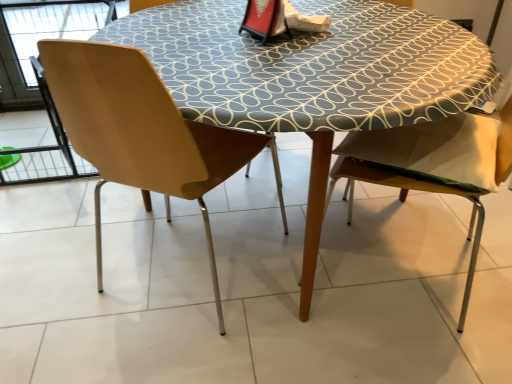
Question: Considering the relative sizes of wooden chair at right, the 2th chair when ordered from left to right, and wooden table at center in the image provided, is wooden chair at right, the 2th chair when ordered from left to right, bigger than wooden table at center?

Choices:
 (A) no
 (B) yes

Answer: (A)

Question: Does wooden chair at right, the 2th chair when ordered from left to right, come behind wooden table at center?

Choices:
 (A) no
 (B) yes

Answer: (A)

Question: Considering the relative sizes of wooden chair at right, the 2th chair when ordered from left to right, and wooden table at center in the image provided, is wooden chair at right, the 2th chair when ordered from left to right, shorter than wooden table at center?

Choices:
 (A) no
 (B) yes

Answer: (A)

Question: Would you consider wooden chair at right, which is the 1th chair from right to left, to be distant from wooden table at center?

Choices:
 (A) yes
 (B) no

Answer: (B)

Question: Is wooden chair at right, the 2th chair when ordered from left to right, at the right side of wooden table at center?

Choices:
 (A) no
 (B) yes

Answer: (B)

Question: Can you confirm if wooden chair at right, the 2th chair when ordered from left to right, is wider than wooden table at center?

Choices:
 (A) yes
 (B) no

Answer: (B)

Question: Is matte wood chair at left, arranged as the 1th chair when viewed from the left, placed right next to wooden table at center?

Choices:
 (A) yes
 (B) no

Answer: (B)

Question: Considering the relative sizes of matte wood chair at left, arranged as the 1th chair when viewed from the left, and wooden table at center in the image provided, is matte wood chair at left, arranged as the 1th chair when viewed from the left, bigger than wooden table at center?

Choices:
 (A) no
 (B) yes

Answer: (A)

Question: Considering the relative sizes of matte wood chair at left, arranged as the 1th chair when viewed from the left, and wooden table at center in the image provided, is matte wood chair at left, arranged as the 1th chair when viewed from the left, thinner than wooden table at center?

Choices:
 (A) yes
 (B) no

Answer: (A)

Question: Does matte wood chair at left, arranged as the second chair when viewed from the right, have a smaller size compared to wooden table at center?

Choices:
 (A) no
 (B) yes

Answer: (B)

Question: Is matte wood chair at left, arranged as the second chair when viewed from the right, to the right of wooden table at center from the viewer's perspective?

Choices:
 (A) yes
 (B) no

Answer: (B)

Question: Is matte wood chair at left, arranged as the 1th chair when viewed from the left, outside wooden table at center?

Choices:
 (A) yes
 (B) no

Answer: (B)

Question: From the image's perspective, would you say wooden chair at right, which is the 1th chair from right to left, is shown under matte wood chair at left, arranged as the second chair when viewed from the right?

Choices:
 (A) yes
 (B) no

Answer: (A)